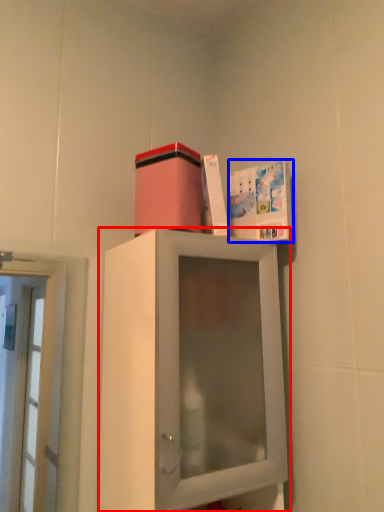
Question: Which of the following is the farthest to the observer, cabinetry (highlighted by a red box) or book cover (highlighted by a blue box)?

Choices:
 (A) cabinetry
 (B) book cover

Answer: (B)